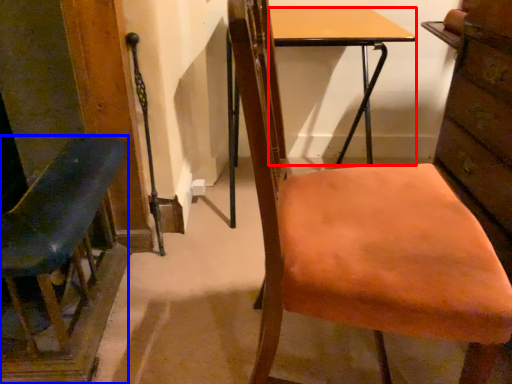
Question: Which object appears farthest to the camera in this image, desk (highlighted by a red box) or chair (highlighted by a blue box)?

Choices:
 (A) desk
 (B) chair

Answer: (A)